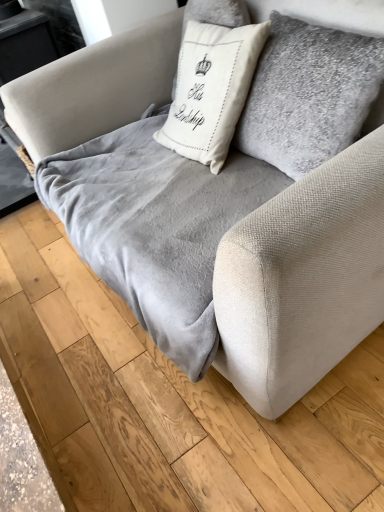
Measure the distance between point (266, 23) and camera.

3.93 feet.

Describe the element at coordinates (211, 90) in the screenshot. This screenshot has height=512, width=384. I see `white cotton cushion at center` at that location.

Where is `white cotton cushion at center`? The image size is (384, 512). white cotton cushion at center is located at coordinates (211, 90).

Describe the element at coordinates (156, 227) in the screenshot. The width and height of the screenshot is (384, 512). I see `velvet gray blanket at center` at that location.

In order to face velvet gray blanket at center, should I rotate leftwards or rightwards?

Rotate your view left by about 2.639°.

This screenshot has width=384, height=512. Identify the location of velvet gray blanket at center. (156, 227).

What is the approximate width of velvet gray blanket at center?

velvet gray blanket at center is 25.60 inches wide.

I want to click on white cotton cushion at center, so click(211, 90).

Considering the relative positions of white cotton cushion at center and velvet gray blanket at center in the image provided, is white cotton cushion at center to the left or to the right of velvet gray blanket at center?

In the image, white cotton cushion at center appears on the right side of velvet gray blanket at center.

Is the position of white cotton cushion at center more distant than that of velvet gray blanket at center?

Yes, white cotton cushion at center is further from the camera.

Is point (180, 143) in front of point (189, 226)?

No, it is behind (189, 226).

From the image's perspective, would you say white cotton cushion at center is positioned over velvet gray blanket at center?

Correct, white cotton cushion at center appears higher than velvet gray blanket at center in the image.

From a real-world perspective, who is located higher, white cotton cushion at center or velvet gray blanket at center?

white cotton cushion at center, from a real-world perspective.

In terms of width, does white cotton cushion at center look wider or thinner when compared to velvet gray blanket at center?

Considering their sizes, white cotton cushion at center looks slimmer than velvet gray blanket at center.

Which of these two, white cotton cushion at center or velvet gray blanket at center, stands shorter?

With less height is velvet gray blanket at center.

Can you confirm if white cotton cushion at center is smaller than velvet gray blanket at center?

Yes.

Is white cotton cushion at center not inside velvet gray blanket at center?

Yes, white cotton cushion at center is located beyond the bounds of velvet gray blanket at center.

Is the surface of white cotton cushion at center in direct contact with velvet gray blanket at center?

No, white cotton cushion at center is not beside velvet gray blanket at center.

Is white cotton cushion at center looking in the opposite direction of velvet gray blanket at center?

No, velvet gray blanket at center is not at the back of white cotton cushion at center.

How many degrees apart are the facing directions of white cotton cushion at center and velvet gray blanket at center?

13 degrees.

The image size is (384, 512). What are the coordinates of `blanket that appears on the left of white cotton cushion at center` in the screenshot? It's located at (156, 227).

Between velvet gray blanket at center and white cotton cushion at center, which one appears on the right side from the viewer's perspective?

Positioned to the right is white cotton cushion at center.

Considering the relative positions of velvet gray blanket at center and white cotton cushion at center in the image provided, is velvet gray blanket at center behind white cotton cushion at center?

That is False.

Is point (184, 328) positioned after point (211, 114)?

No, it is in front of (211, 114).

From the image's perspective, is velvet gray blanket at center below white cotton cushion at center?

Yes.

From a real-world perspective, is velvet gray blanket at center on top of white cotton cushion at center?

No, from a real-world perspective, velvet gray blanket at center is not above white cotton cushion at center.

In the scene shown: Is velvet gray blanket at center wider than white cotton cushion at center?

Correct, the width of velvet gray blanket at center exceeds that of white cotton cushion at center.

Considering the sizes of objects velvet gray blanket at center and white cotton cushion at center in the image provided, who is shorter, velvet gray blanket at center or white cotton cushion at center?

Standing shorter between the two is velvet gray blanket at center.

Considering the sizes of velvet gray blanket at center and white cotton cushion at center in the image, is velvet gray blanket at center bigger or smaller than white cotton cushion at center?

velvet gray blanket at center is bigger than white cotton cushion at center.

Is white cotton cushion at center completely or partially inside velvet gray blanket at center?

No, white cotton cushion at center is not a part of velvet gray blanket at center.

Is velvet gray blanket at center placed right next to white cotton cushion at center?

No, velvet gray blanket at center is not next to white cotton cushion at center.

Is velvet gray blanket at center facing towards white cotton cushion at center?

No, velvet gray blanket at center does not turn towards white cotton cushion at center.

Can you tell me how much velvet gray blanket at center and white cotton cushion at center differ in facing direction?

13 degrees separate the facing orientations of velvet gray blanket at center and white cotton cushion at center.

Measure the distance from velvet gray blanket at center to white cotton cushion at center.

24.00 centimeters.

Where is `pillow located behind the velvet gray blanket at center`? The height and width of the screenshot is (512, 384). pillow located behind the velvet gray blanket at center is located at coordinates (211, 90).

The height and width of the screenshot is (512, 384). In order to click on blanket located on the left of white cotton cushion at center in this screenshot , I will do `click(156, 227)`.

Identify the location of blanket lying in front of the white cotton cushion at center. The image size is (384, 512). (156, 227).